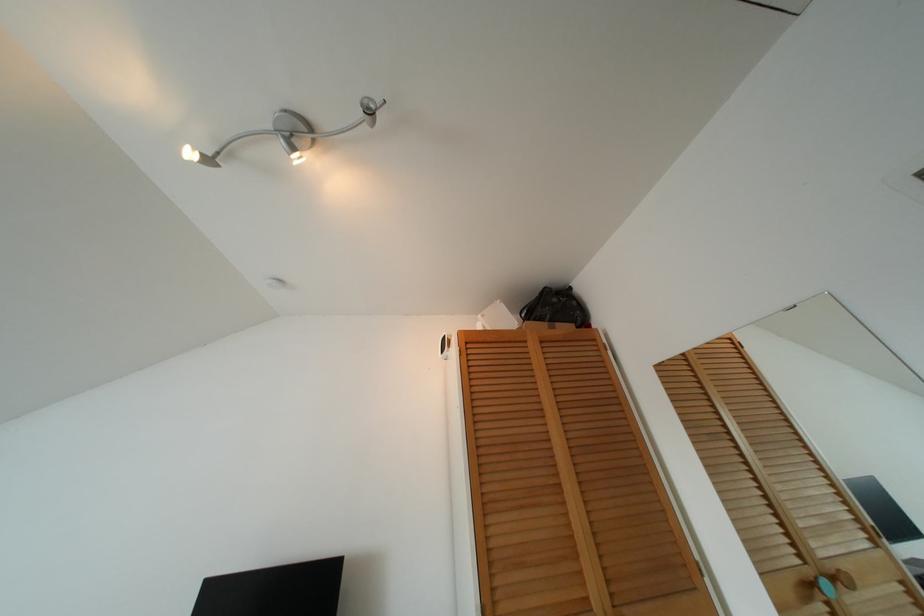
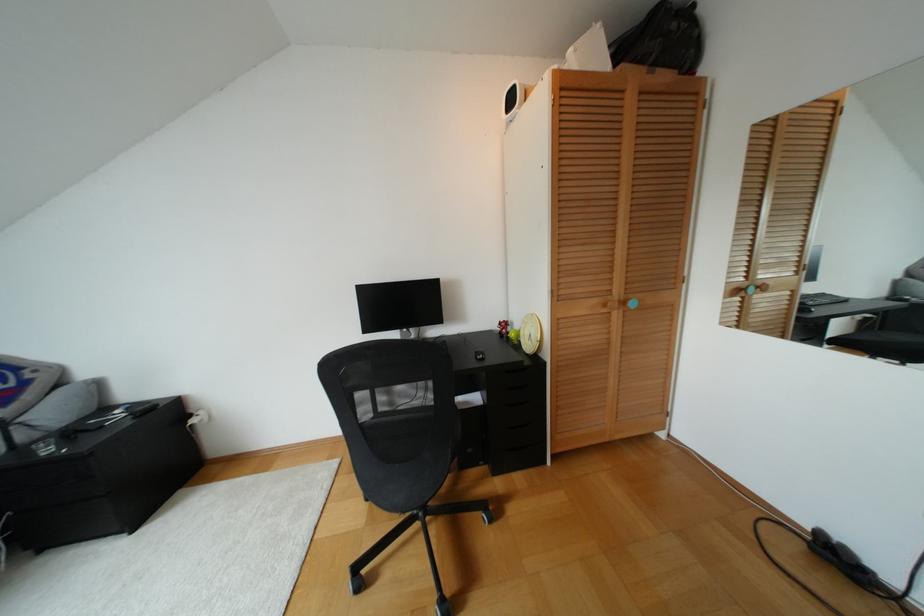
Where in the second image is the point corresponding to point 825,585 from the first image?

(750, 288)